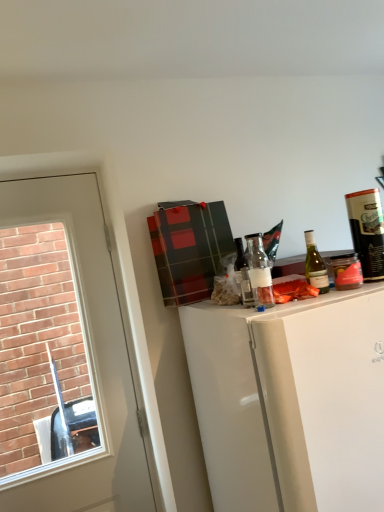
Question: From a real-world perspective, is translucent glass bottle at center, the 1th bottle in the left-to-right sequence, physically located above or below green glass bottle at upper right, the second bottle when ordered from left to right?

Choices:
 (A) above
 (B) below

Answer: (A)

Question: Is point (243, 296) positioned closer to the camera than point (319, 261)?

Choices:
 (A) farther
 (B) closer

Answer: (A)

Question: Which of these objects is positioned farthest from the green glass bottle at upper right?

Choices:
 (A) matte black canister at upper right, acting as the first bottle starting from the right
 (B) green glass bottle at upper right, placed as the 2th bottle when sorted from right to left
 (C) white glossy refrigerator at upper right
 (D) white glossy door at left
 (E) translucent glass bottle at center, which appears as the third bottle when viewed from the right

Answer: (D)

Question: Which of these objects is positioned closest to the white glossy refrigerator at upper right?

Choices:
 (A) matte black canister at upper right, acting as the first bottle starting from the right
 (B) translucent glass bottle at center, which appears as the third bottle when viewed from the right
 (C) green glass bottle at upper right
 (D) white glossy door at left
 (E) green glass bottle at upper right, the second bottle when ordered from left to right

Answer: (B)